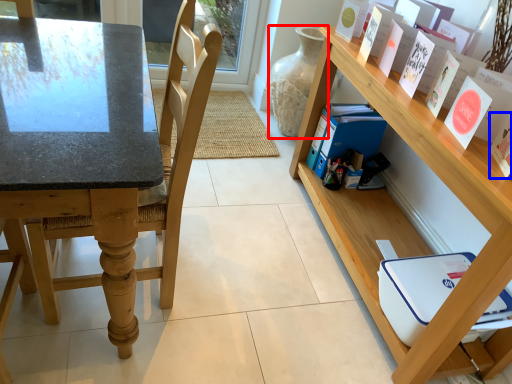
Question: Which point is further to the camera, glass vase (highlighted by a red box) or paperback book (highlighted by a blue box)?

Choices:
 (A) glass vase
 (B) paperback book

Answer: (A)